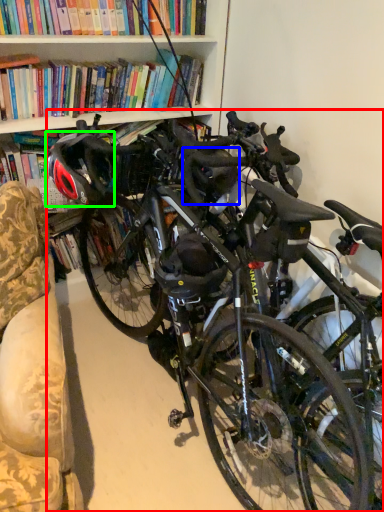
Question: Based on their relative distances, which object is nearer to bicycle (highlighted by a red box)? Choose from helmet (highlighted by a blue box) and bicycle helmet (highlighted by a green box).

Choices:
 (A) helmet
 (B) bicycle helmet

Answer: (A)